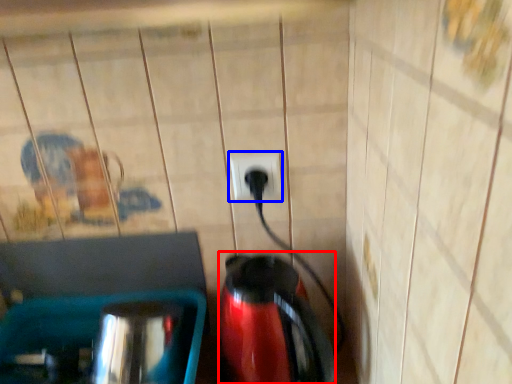
Question: Which object is closer to the camera taking this photo, coffeepot (highlighted by a red box) or power plugs and sockets (highlighted by a blue box)?

Choices:
 (A) coffeepot
 (B) power plugs and sockets

Answer: (A)